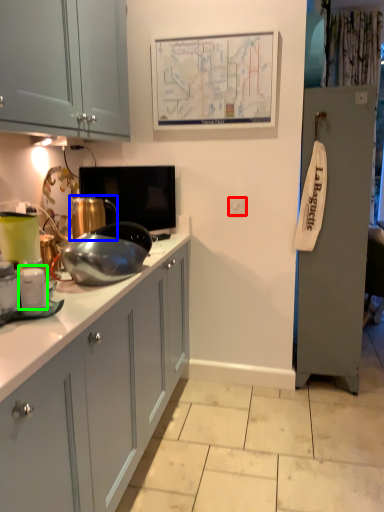
Question: Which object is positioned farthest from electric outlet (highlighted by a red box)? Select from appliance (highlighted by a blue box) and appliance (highlighted by a green box).

Choices:
 (A) appliance
 (B) appliance

Answer: (B)